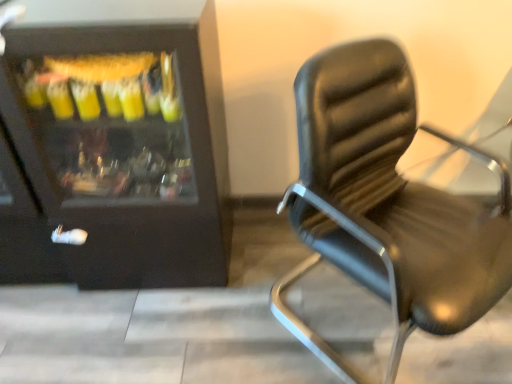
The height and width of the screenshot is (384, 512). I want to click on black leather chair at right, so click(x=386, y=204).

What do you see at coordinates (386, 204) in the screenshot? The image size is (512, 384). I see `black leather chair at right` at bounding box center [386, 204].

Where is `black leather chair at right`? The width and height of the screenshot is (512, 384). black leather chair at right is located at coordinates pyautogui.click(x=386, y=204).